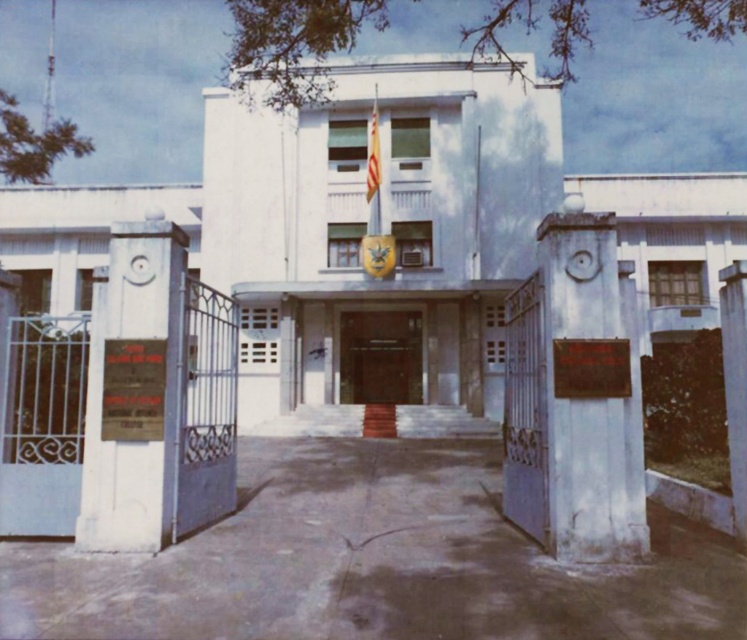
Question: Does white stone plaque at left have a larger size compared to brown wooden door at center?

Choices:
 (A) yes
 (B) no

Answer: (B)

Question: Is smooth gray stone plaque at center below white concrete pillar at right?

Choices:
 (A) no
 (B) yes

Answer: (A)

Question: Which object is closer to the camera taking this photo?

Choices:
 (A) white concrete pillar at right
 (B) white stone plaque at left
 (C) brown wooden door at center
 (D) smooth gray stone plaque at center

Answer: (D)

Question: Which object is the closest to the brown wooden door at center?

Choices:
 (A) white concrete pillar at right
 (B) smooth gray stone plaque at center

Answer: (A)

Question: Is brown wooden door at center wider than white concrete pillar at right?

Choices:
 (A) yes
 (B) no

Answer: (A)

Question: Which of the following is the farthest from the observer?

Choices:
 (A) white stone plaque at left
 (B) smooth gray stone plaque at center
 (C) white concrete pillar at right
 (D) brown wooden door at center

Answer: (D)